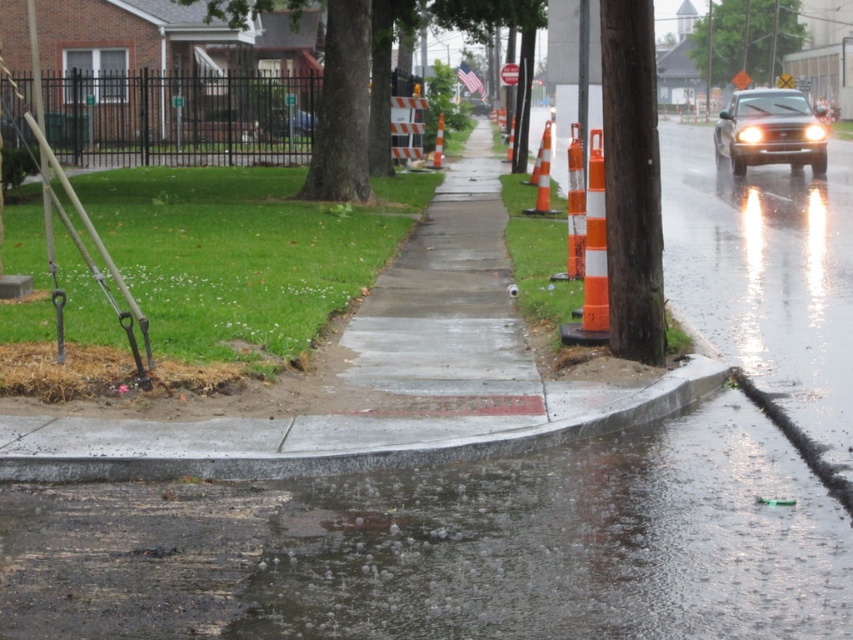
You are a delivery driver approaching the shiny black car at right and the orange reflective traffic cone at center on a wet road. Which object is wider?

The shiny black car at right is wider than the orange reflective traffic cone at center.

You are standing at the edge of the sidewalk in the rainy urban street scene. There are two points marked on the ground. Which point is closer to you, point (817, 124) or point (508, 152)?

Point (817, 124) is closer to the viewer than point (508, 152).